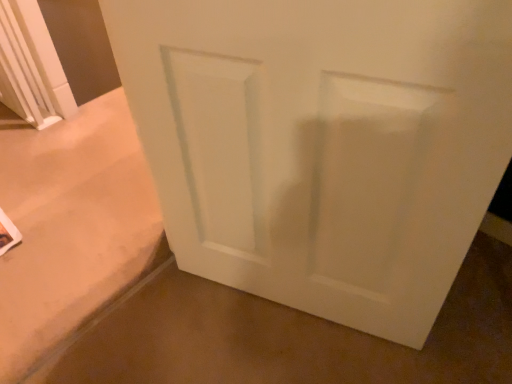
Question: Considering the positions of point (330, 302) and point (155, 362), is point (330, 302) closer or farther from the camera than point (155, 362)?

Choices:
 (A) closer
 (B) farther

Answer: (A)

Question: From the image's perspective, is white matte door at center located above or below white smooth door at center?

Choices:
 (A) below
 (B) above

Answer: (B)

Question: Is white matte door at center taller or shorter than white smooth door at center?

Choices:
 (A) tall
 (B) short

Answer: (A)

Question: From the image's perspective, relative to white matte door at center, is white smooth door at center above or below?

Choices:
 (A) above
 (B) below

Answer: (B)

Question: Is white smooth door at center spatially inside white matte door at center, or outside of it?

Choices:
 (A) inside
 (B) outside

Answer: (B)

Question: Is white smooth door at center in front of or behind white matte door at center in the image?

Choices:
 (A) front
 (B) behind

Answer: (B)

Question: Based on their positions, is white smooth door at center located to the left or right of white matte door at center?

Choices:
 (A) right
 (B) left

Answer: (A)